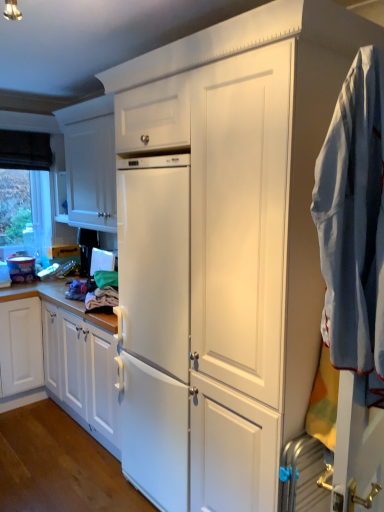
Question: From the image's perspective, is light blue cotton shirt at right beneath white matte cabinet at upper left?

Choices:
 (A) yes
 (B) no

Answer: (A)

Question: Is white matte cabinet at upper left inside light blue cotton shirt at right?

Choices:
 (A) no
 (B) yes

Answer: (A)

Question: Can you confirm if light blue cotton shirt at right is shorter than white matte cabinet at upper left?

Choices:
 (A) yes
 (B) no

Answer: (B)

Question: Is light blue cotton shirt at right not within white matte cabinet at upper left?

Choices:
 (A) no
 (B) yes

Answer: (B)

Question: Is light blue cotton shirt at right behind white matte cabinet at upper left?

Choices:
 (A) yes
 (B) no

Answer: (B)

Question: Is light blue cotton shirt at right taller than white matte cabinet at upper left?

Choices:
 (A) no
 (B) yes

Answer: (B)

Question: Can you confirm if transparent glass window at upper left is thinner than light blue cotton shirt at right?

Choices:
 (A) no
 (B) yes

Answer: (B)

Question: From a real-world perspective, does transparent glass window at upper left sit lower than light blue cotton shirt at right?

Choices:
 (A) no
 (B) yes

Answer: (A)

Question: Can you confirm if transparent glass window at upper left is wider than light blue cotton shirt at right?

Choices:
 (A) no
 (B) yes

Answer: (A)

Question: Does transparent glass window at upper left lie in front of light blue cotton shirt at right?

Choices:
 (A) yes
 (B) no

Answer: (B)

Question: Is transparent glass window at upper left in contact with light blue cotton shirt at right?

Choices:
 (A) yes
 (B) no

Answer: (B)

Question: From a real-world perspective, is transparent glass window at upper left located higher than light blue cotton shirt at right?

Choices:
 (A) no
 (B) yes

Answer: (B)

Question: Does light blue cotton shirt at right have a smaller size compared to transparent glass window at upper left?

Choices:
 (A) no
 (B) yes

Answer: (A)